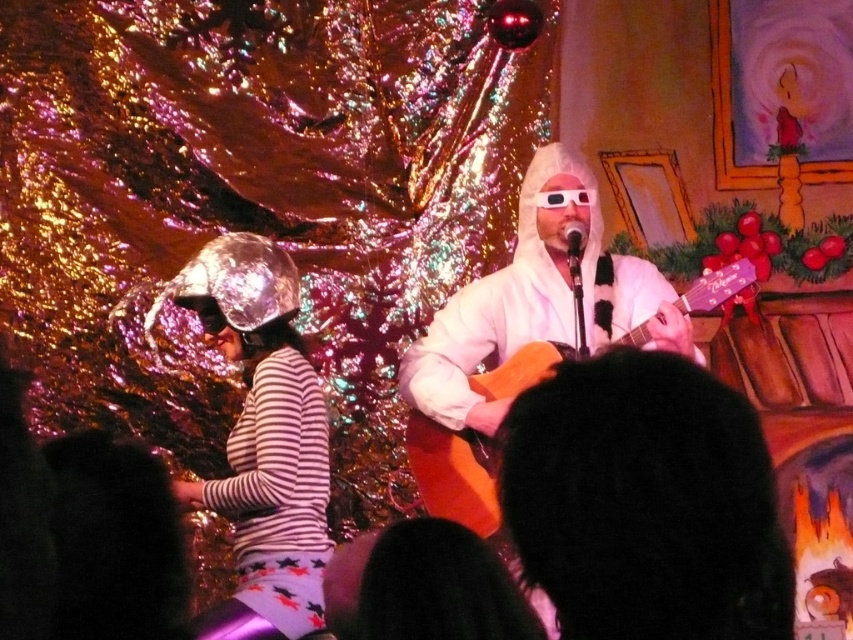
You are a stagehand preparing to adjust the lighting for the performance. You need to position a spotlight exactly at the coordinates point [262,440]. According to the scene, what object is located at that point?

The shiny metallic helmet at left is located at point [262,440].

Consider the image. You are a stagehand setting up for a performance. You need to place a new decorative banner between the matte orange acoustic guitar at center and the metallic silver microphone at center. Based on their positions, which side of the microphone should the banner be placed?

The matte orange acoustic guitar at center is positioned on the right side of the metallic silver microphone at center, so the banner should be placed to the right of the metallic silver microphone at center to be between them.

You are a stagehand preparing to move the black fuzzy hat at center and the shiny metallic helmet at left to storage. The storage area has a 10 meter limit for the distance between items. Can you place both items in the storage without exceeding the distance limit?

The black fuzzy hat at center and shiny metallic helmet at left are 11.28 meters apart. Since the storage area has a 10 meter limit, placing them at this distance would exceed the allowed distance. You need to adjust their positions to ensure they are within 10 meters of each other.